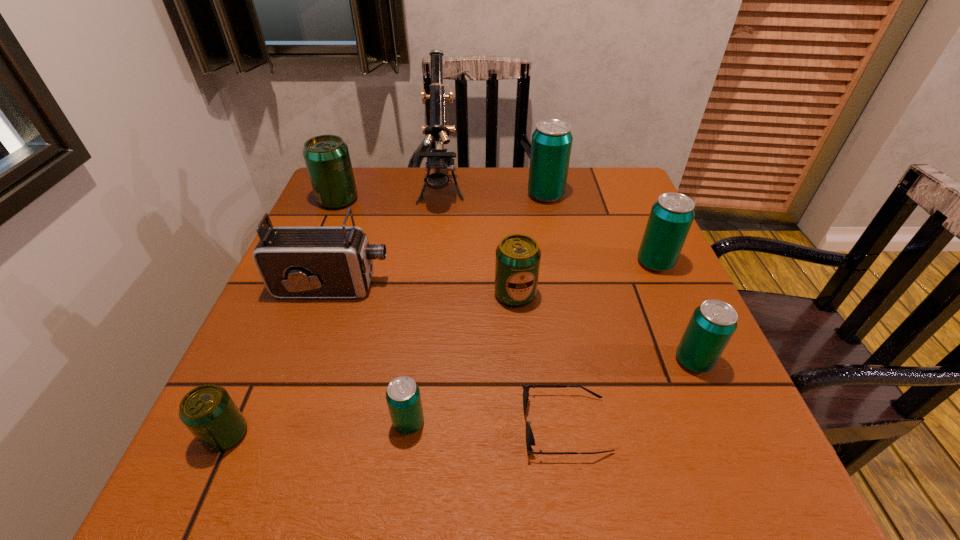
You are a GUI agent. You are given a task and a screenshot of the screen. Output one action in this format:
    pyautogui.click(x=<x>, y=<y>)
    Task: Click on the camcorder that is at the left edge
    The image size is (960, 540).
    Given the screenshot: What is the action you would take?
    pyautogui.click(x=294, y=262)

The width and height of the screenshot is (960, 540). In order to click on object situated at the far left corner in this screenshot , I will do coord(327,159).

Identify the location of object located at the near left corner. The height and width of the screenshot is (540, 960). (208, 411).

At what (x,y) coordinates should I click in order to perform the action: click on free space at the far edge of the desktop. Please return your answer as a coordinate pair (x, y). Looking at the image, I should click on (501, 199).

This screenshot has width=960, height=540. In the image, there is a desktop. In order to click on free space at the left edge in this screenshot , I will do `click(294, 378)`.

At what (x,y) coordinates should I click in order to perform the action: click on vacant space at the right edge of the desktop. Please return your answer as a coordinate pair (x, y). The width and height of the screenshot is (960, 540). Looking at the image, I should click on (605, 264).

Where is `vacant space at the near left corner of the desktop`? The image size is (960, 540). vacant space at the near left corner of the desktop is located at coordinates (191, 465).

Where is `vacant space at the far right corner`? vacant space at the far right corner is located at coordinates (618, 184).

Find the location of a particular element. The height and width of the screenshot is (540, 960). vacant space that's between the rightmost green beer can and the microscope is located at coordinates (478, 243).

This screenshot has height=540, width=960. What are the coordinates of `free space between the third nearest teal beer can and the fourth nearest object` in the screenshot? It's located at (675, 312).